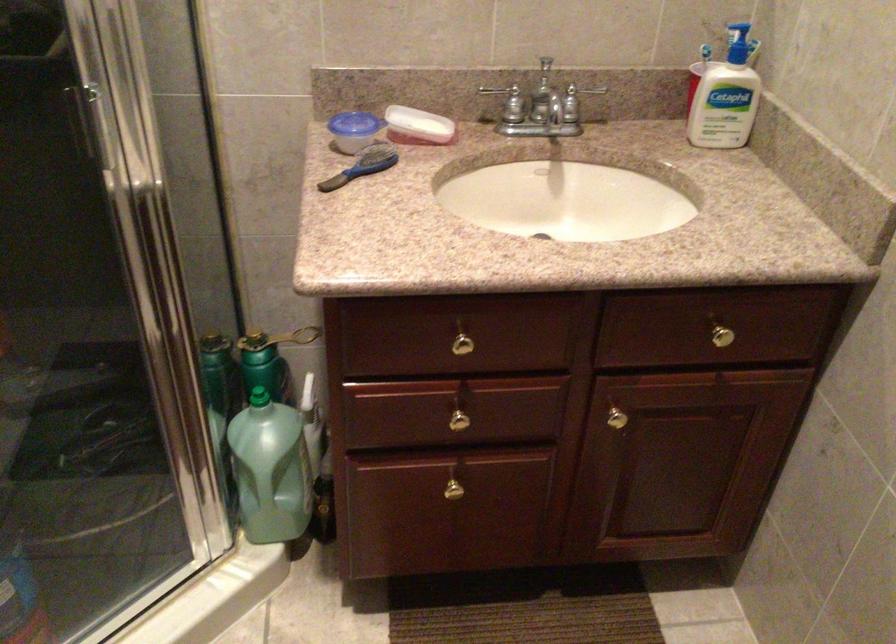
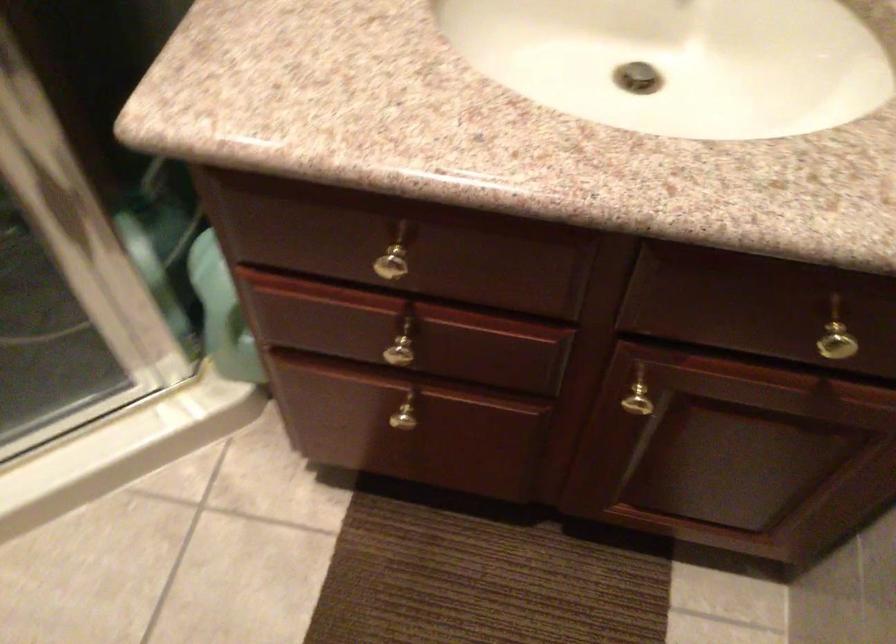
The images are taken continuously from a first-person perspective. In which direction are you moving?

The cameraman moved toward right, forward.